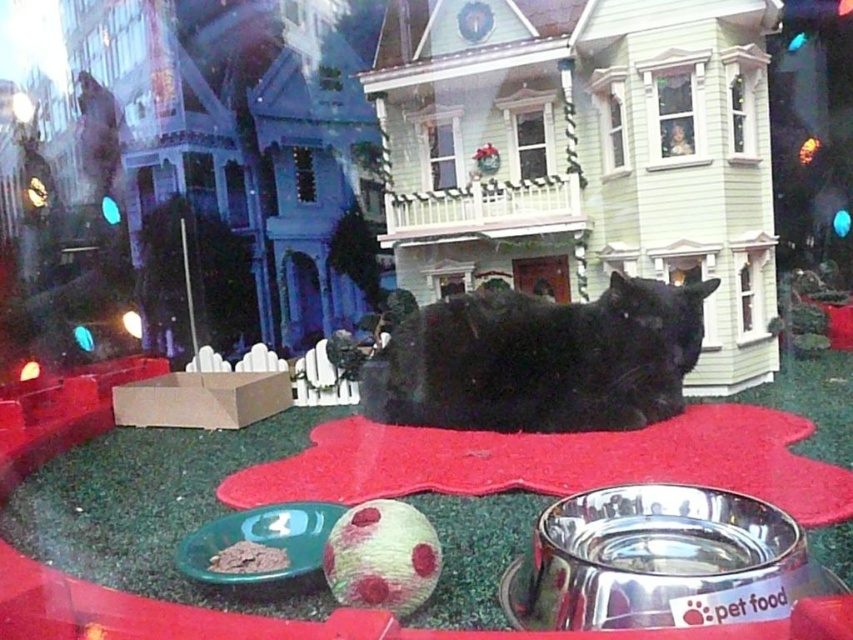
You are a small toy mouse navigating the dollhouse scene. You start at the point labeled point (404, 532) and want to reach the point labeled point (583, 468). Which direction should you move to get closer to your destination?

To reach point (583, 468) from point (404, 532), you should move towards the upper left direction since point (583, 468) is behind point (404, 532).